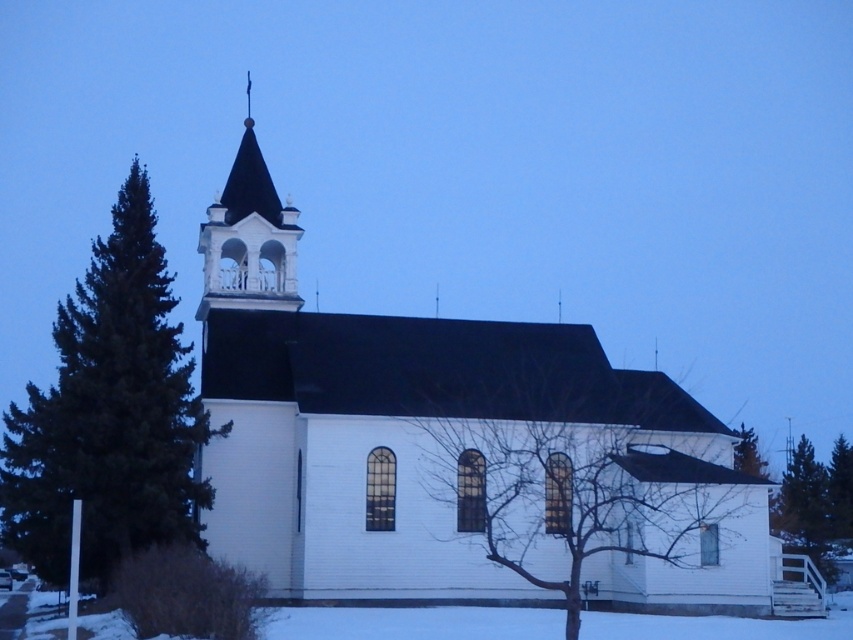
Does white wood church at center lie behind bare branches at center?

Yes.

Does white wood church at center have a greater height compared to bare branches at center?

Correct, white wood church at center is much taller as bare branches at center.

Is point (461, 417) more distant than point (456, 385)?

No.

Where is `white wood church at center`? This screenshot has height=640, width=853. white wood church at center is located at coordinates (451, 449).

Does point (466, 346) lie in front of point (247, 164)?

Yes.

Who is taller, white wood church at center or white wood spire at upper center?

With more height is white wood church at center.

Locate an element on the screen. white wood church at center is located at coordinates (451, 449).

Where is `white wood church at center`? The width and height of the screenshot is (853, 640). white wood church at center is located at coordinates pos(451,449).

Who is higher up, bare branches at center or green coniferous tree at left?

Positioned higher is green coniferous tree at left.

Is bare branches at center in front of green coniferous tree at left?

Yes, it is.

The width and height of the screenshot is (853, 640). Identify the location of bare branches at center. (581, 472).